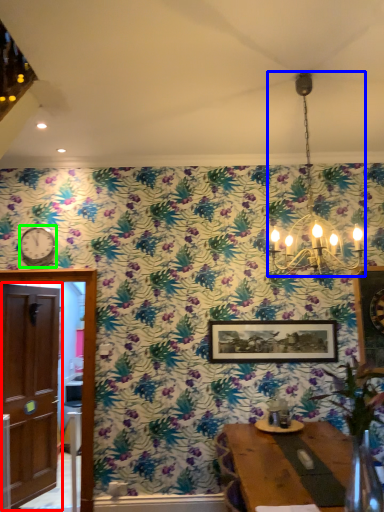
Question: Estimate the real-world distances between objects in this image. Which object is closer to door (highlighted by a red box), light fixture (highlighted by a blue box) or clock (highlighted by a green box)?

Choices:
 (A) light fixture
 (B) clock

Answer: (B)